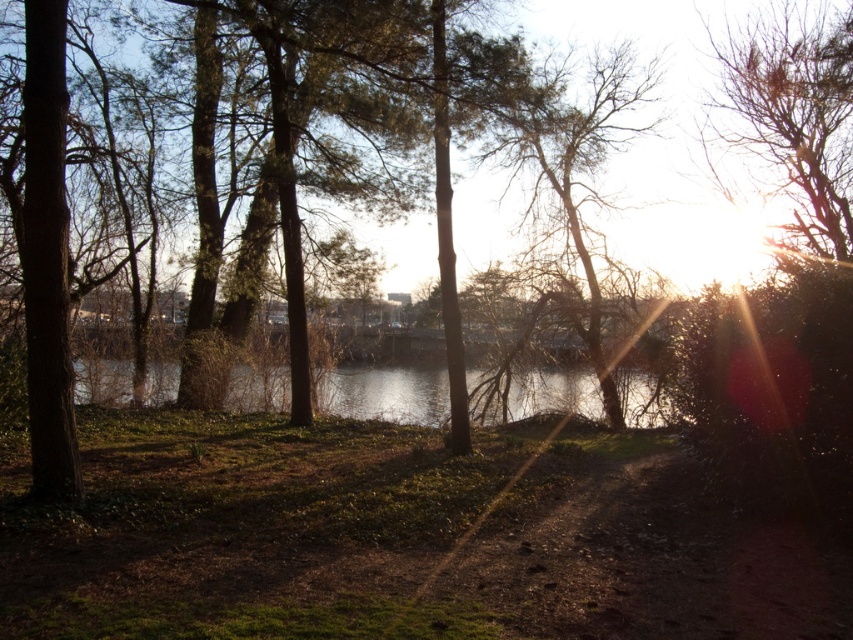
Can you confirm if bare branches at upper right is wider than clear water at center?

In fact, bare branches at upper right might be narrower than clear water at center.

Looking at this image, is bare branches at upper right further to the viewer compared to clear water at center?

That is True.

Who is more distant from viewer, (833, 196) or (100, 401)?

The point (833, 196) is more distant.

The height and width of the screenshot is (640, 853). Identify the location of bare branches at upper right. (795, 118).

Who is more forward, (648, 124) or (529, 410)?

Point (529, 410)

Who is lower down, bare branches at upper center or clear water at center?

clear water at center

Is point (550, 74) behind point (566, 384)?

No, it is in front of (566, 384).

The image size is (853, 640). Find the location of `bare branches at upper center`. bare branches at upper center is located at coordinates (575, 168).

Who is lower down, bare branches at upper right or bare branches at upper center?

bare branches at upper center is lower down.

Can you confirm if bare branches at upper right is bigger than bare branches at upper center?

No.

You are a GUI agent. You are given a task and a screenshot of the screen. Output one action in this format:
    pyautogui.click(x=<x>, y=<y>)
    Task: Click on the bare branches at upper right
    
    Given the screenshot: What is the action you would take?
    pyautogui.click(x=795, y=118)

Where is `bare branches at upper right`? Image resolution: width=853 pixels, height=640 pixels. bare branches at upper right is located at coordinates (795, 118).